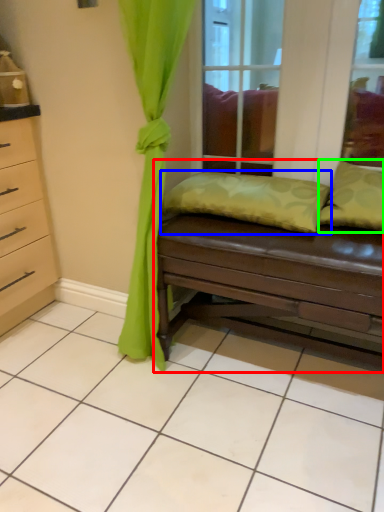
Question: Which is nearer to the studio couch (highlighted by a red box)? pillow (highlighted by a blue box) or pillow (highlighted by a green box).

Choices:
 (A) pillow
 (B) pillow

Answer: (A)